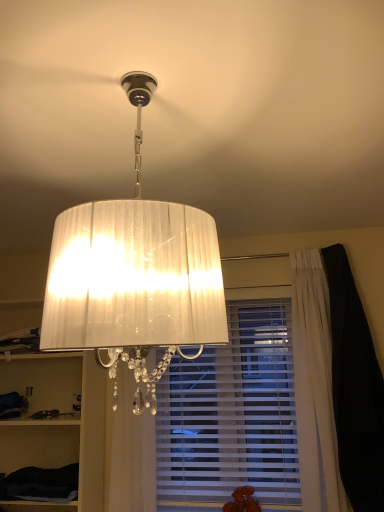
Question: Is white fabric cabinet at left, which ranks as the 2th cabinet in bottom-to-top order, far from white pleated fabric lampshade at upper center?

Choices:
 (A) yes
 (B) no

Answer: (A)

Question: Is white fabric cabinet at left, the first cabinet when ordered from top to bottom, bigger than white pleated fabric lampshade at upper center?

Choices:
 (A) yes
 (B) no

Answer: (A)

Question: From the image's perspective, is white fabric cabinet at left, which ranks as the 2th cabinet in bottom-to-top order, under white pleated fabric lampshade at upper center?

Choices:
 (A) no
 (B) yes

Answer: (B)

Question: Is white pleated fabric lampshade at upper center completely or partially inside white fabric cabinet at left, which ranks as the 2th cabinet in bottom-to-top order?

Choices:
 (A) no
 (B) yes

Answer: (A)

Question: Is white fabric cabinet at left, which ranks as the 2th cabinet in bottom-to-top order, beside white pleated fabric lampshade at upper center?

Choices:
 (A) yes
 (B) no

Answer: (B)

Question: Looking at their shapes, would you say dark fabric cabinet at lower left, which is the first cabinet in bottom-to-top order, is wider or thinner than white pleated curtain at lower center?

Choices:
 (A) wide
 (B) thin

Answer: (A)

Question: From the image's perspective, is dark fabric cabinet at lower left, which is the first cabinet in bottom-to-top order, positioned above or below white pleated curtain at lower center?

Choices:
 (A) above
 (B) below

Answer: (B)

Question: Visually, is dark fabric cabinet at lower left, which is the first cabinet in bottom-to-top order, positioned to the left or to the right of white pleated curtain at lower center?

Choices:
 (A) left
 (B) right

Answer: (A)

Question: Considering the positions of dark fabric cabinet at lower left, which appears as the second cabinet when viewed from the top, and white pleated curtain at lower center in the image, is dark fabric cabinet at lower left, which appears as the second cabinet when viewed from the top, bigger or smaller than white pleated curtain at lower center?

Choices:
 (A) small
 (B) big

Answer: (A)

Question: Is dark fabric cabinet at lower left, which is the first cabinet in bottom-to-top order, wider or thinner than white fabric cabinet at left, the first cabinet when ordered from top to bottom?

Choices:
 (A) thin
 (B) wide

Answer: (A)

Question: From a real-world perspective, is dark fabric cabinet at lower left, which is the first cabinet in bottom-to-top order, positioned above or below white fabric cabinet at left, which ranks as the 2th cabinet in bottom-to-top order?

Choices:
 (A) above
 (B) below

Answer: (B)

Question: Does point (13, 456) appear closer or farther from the camera than point (49, 400)?

Choices:
 (A) farther
 (B) closer

Answer: (B)

Question: In the image, is dark fabric cabinet at lower left, which is the first cabinet in bottom-to-top order, positioned in front of or behind white fabric cabinet at left, which ranks as the 2th cabinet in bottom-to-top order?

Choices:
 (A) front
 (B) behind

Answer: (B)

Question: Relative to white fabric cabinet at left, the first cabinet when ordered from top to bottom, is white sheer curtain at center in front or behind?

Choices:
 (A) front
 (B) behind

Answer: (A)

Question: In terms of height, does white sheer curtain at center look taller or shorter compared to white fabric cabinet at left, the first cabinet when ordered from top to bottom?

Choices:
 (A) short
 (B) tall

Answer: (A)